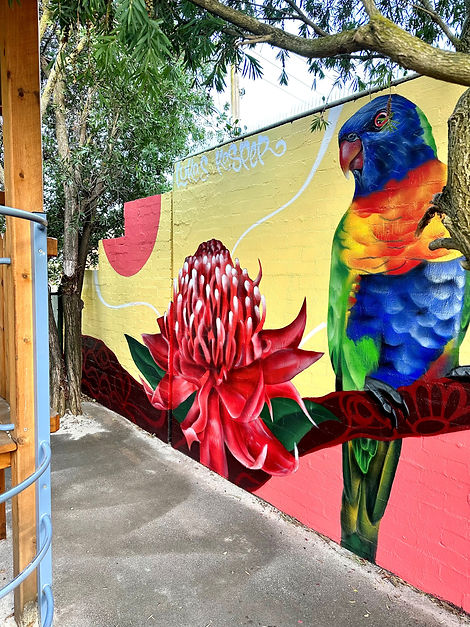
You are a GUI agent. You are given a task and a screenshot of the screen. Output one action in this format:
    pyautogui.click(x=<x>, y=<y>)
    Task: Click on the mural painting of tree branch
    This screenshot has height=627, width=470.
    Given the screenshot: What is the action you would take?
    pyautogui.click(x=341, y=424), pyautogui.click(x=113, y=391)